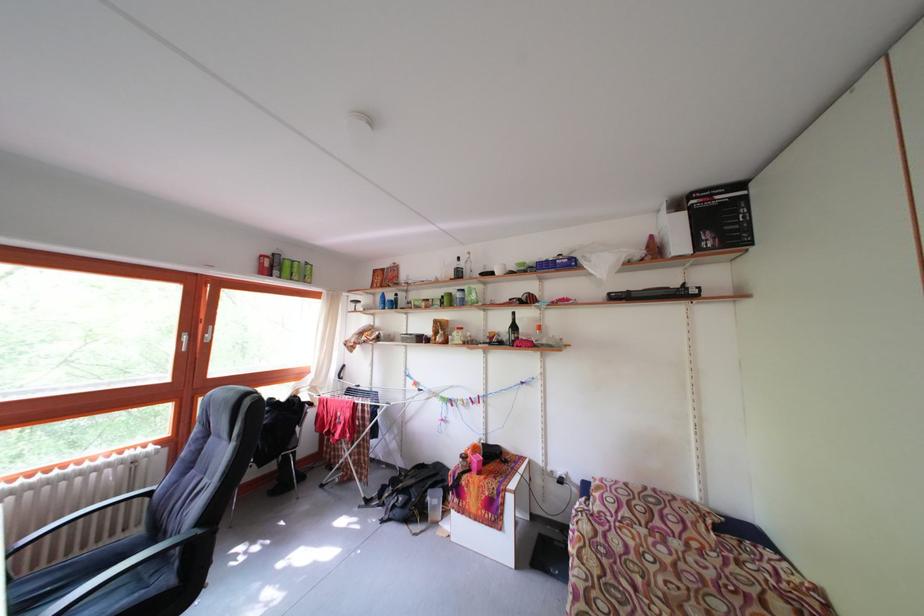
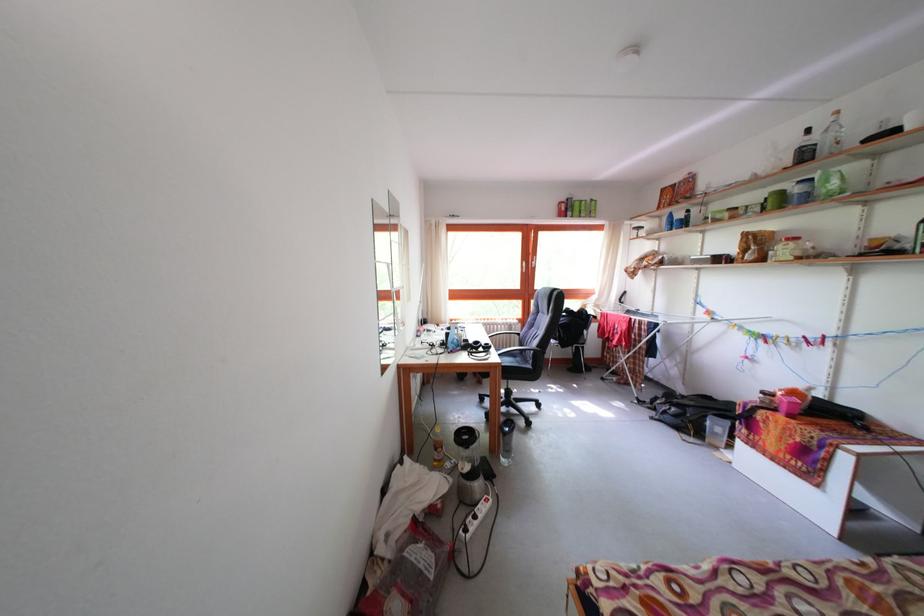
Where in the second image is the point corresponding to (x=382, y=301) from the first image?

(667, 224)